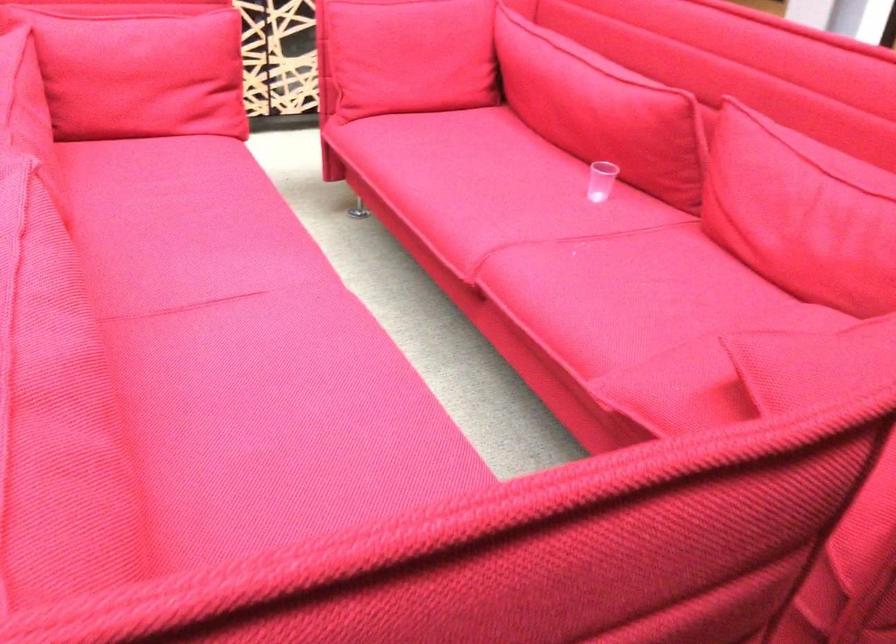
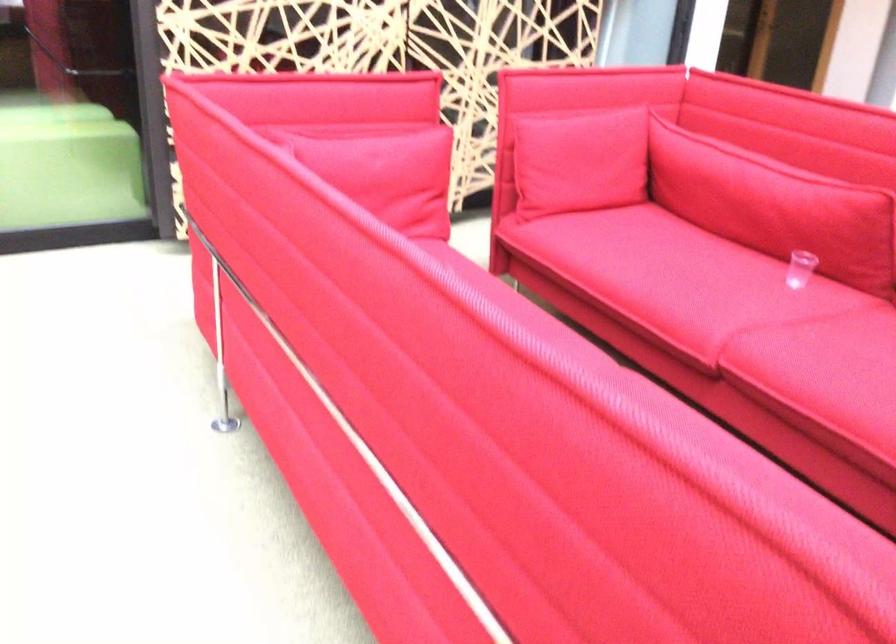
Question: Based on the continuous images, in which direction is the camera rotating? Reply with the corresponding letter.

Choices:
 (A) Left
 (B) Right
 (C) Up
 (D) Down

Answer: (C)